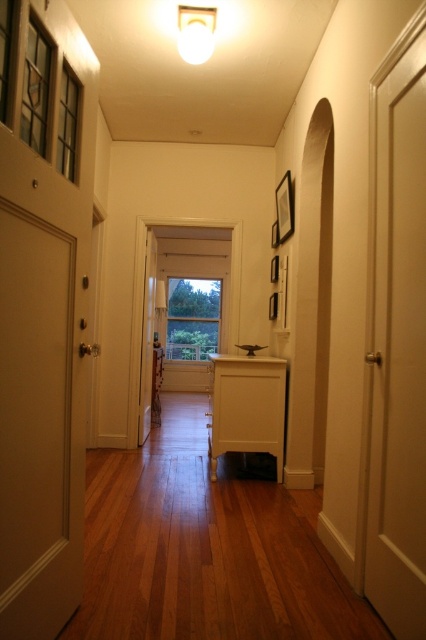
You are standing at the entrance of the hallway and want to open the closest door. Which door should you approach, the white matte door at right or the white matte door at left?

The white matte door at right is closer to you since it is further to the viewer than the white matte door at left, so you should approach the white matte door at right.

From the picture: You are standing at the entrance of the hallway and want to open the door closest to the ceiling. Which door should you approach, the white matte door at right or the white matte door at left?

The white matte door at right is above the white matte door at left, so the white matte door at right is closer to the ceiling. Therefore, you should approach the white matte door at right.